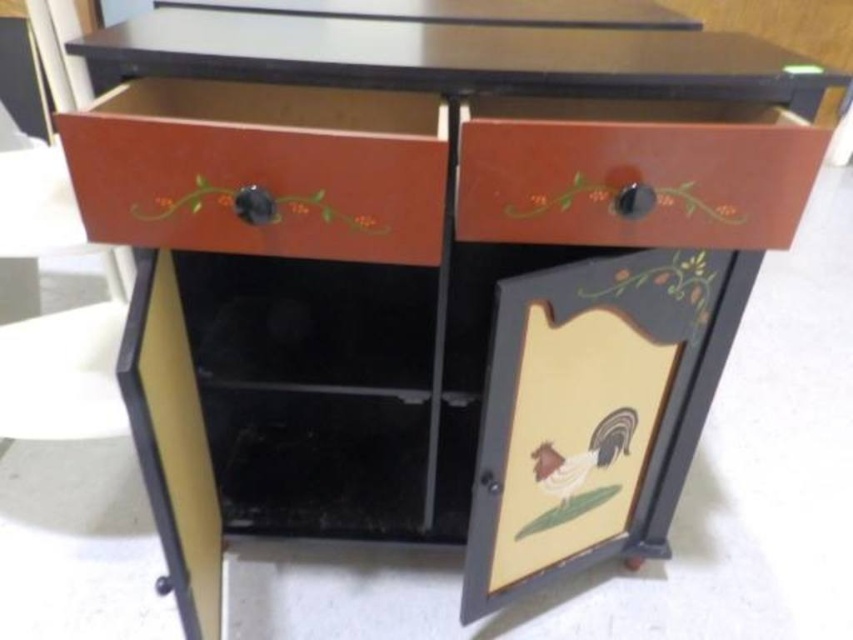
Question: Is matte wood drawer at upper left further to camera compared to matte brown drawer at upper right?

Choices:
 (A) no
 (B) yes

Answer: (A)

Question: Can you confirm if matte wood drawer at upper left is bigger than matte brown drawer at upper right?

Choices:
 (A) no
 (B) yes

Answer: (B)

Question: Does matte wood drawer at upper left appear on the left side of matte brown drawer at upper right?

Choices:
 (A) yes
 (B) no

Answer: (A)

Question: Which of the following is the closest to the observer?

Choices:
 (A) (650, 188)
 (B) (103, 108)

Answer: (B)

Question: Which point is closer to the camera?

Choices:
 (A) (637, 234)
 (B) (86, 163)

Answer: (B)